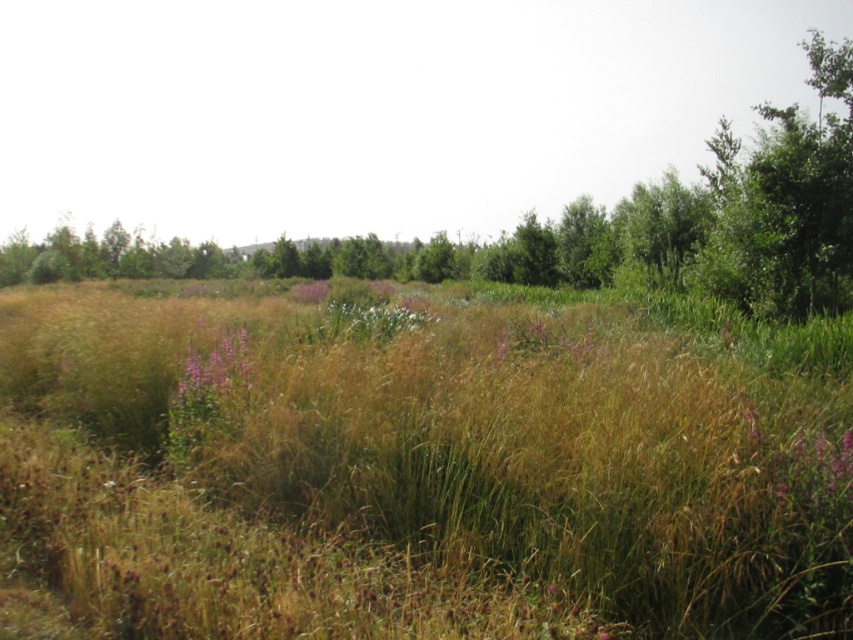
You are a botanist standing in the field and want to collect samples of both the purple matte flower at center and the purple soft flower at center. If your collection basket can only hold items within a 20 meter radius, can you collect both without moving your position?

The distance between the purple matte flower at center and purple soft flower at center is 24.69 meters, which exceeds the 20 meter radius of your basket. Therefore, you cannot collect both without moving your position.

You are standing in the middle of the field and see both the purple matte flower at center and the purple soft flower at center. Which one is positioned to the right side from your perspective?

The purple matte flower at center is positioned to the right of the purple soft flower at center, so the purple matte flower at center is on the right side from your perspective.

You are standing in the field of tall grasses and wildflowers described. You see a point marked at coordinates (x=213, y=378). What object is located at that point?

The point at coordinates (x=213, y=378) indicates a purple matte flower at center.